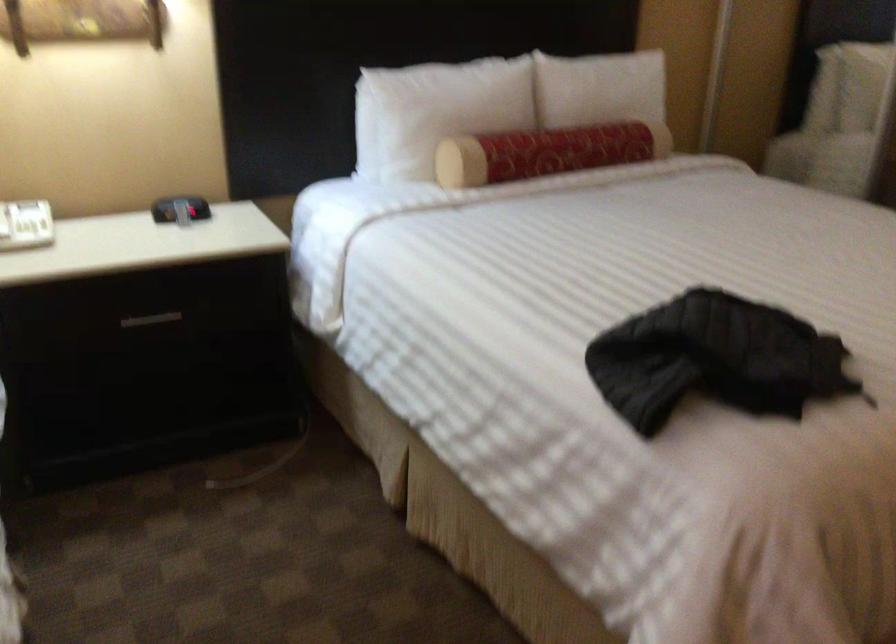
What do you see at coordinates (3, 222) in the screenshot? I see `the telephone handset` at bounding box center [3, 222].